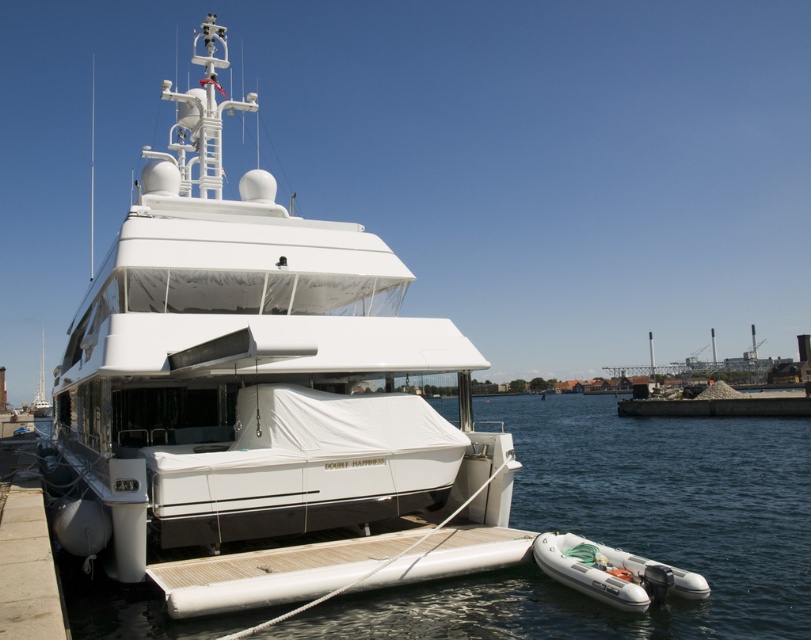
You are standing on the pier looking at the yacht. Where is the white glossy yacht located relative to the point marked at coordinates (264,397)?

The white glossy yacht at center is located exactly at the point marked at coordinates (264,397).